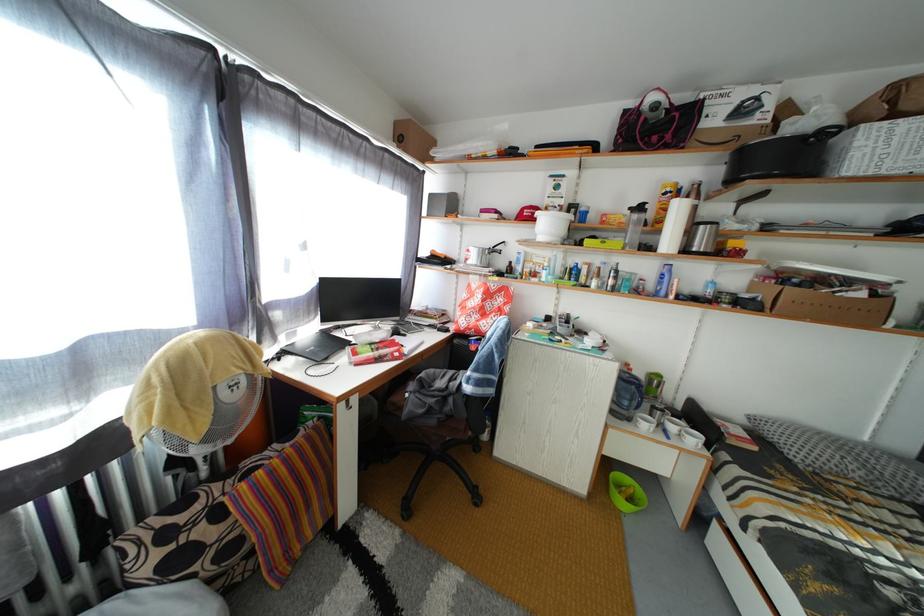
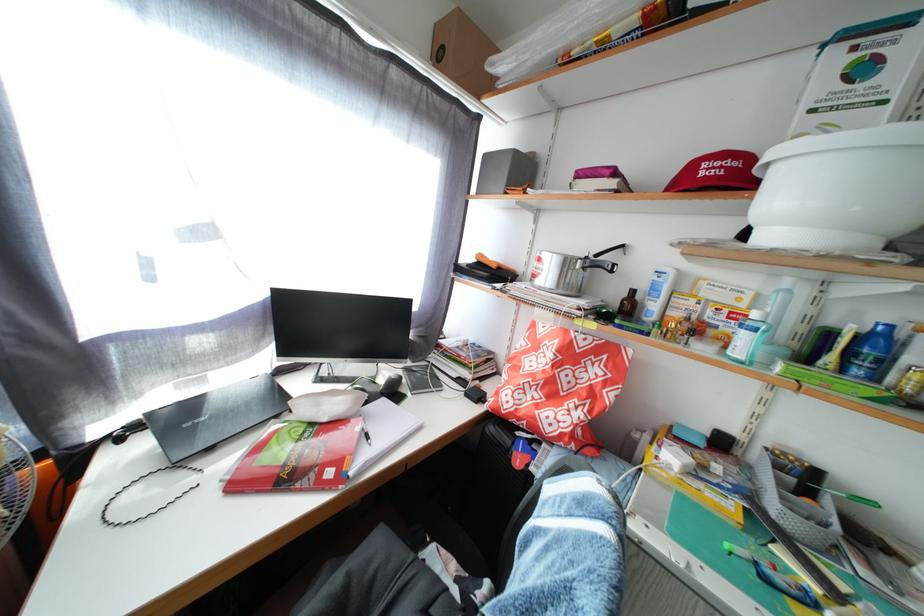
Find the pixel in the second image that matches point (580, 286) in the first image.

(866, 378)